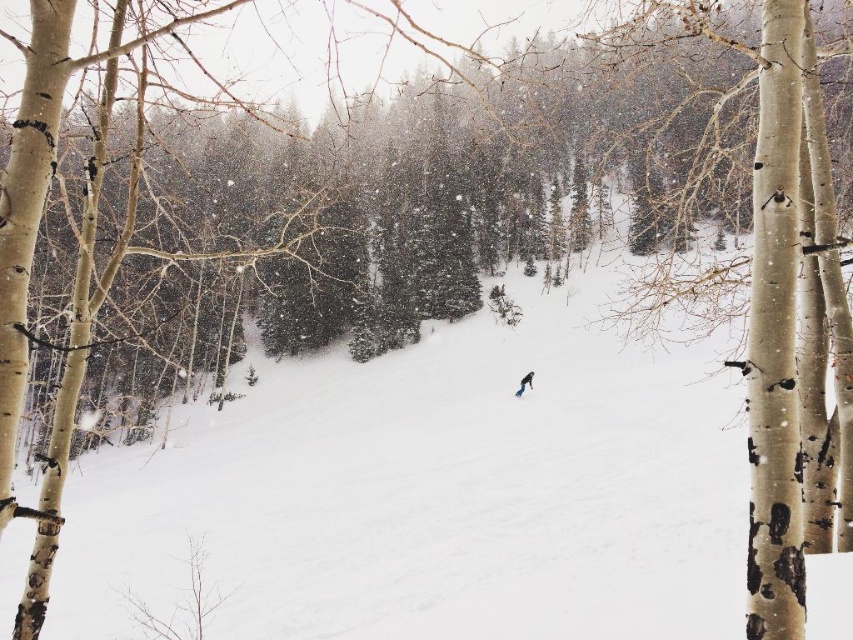
Is blue matte snowboard at center positioned in front of blue metallic ski at center?

No, blue matte snowboard at center is further to the viewer.

Between point (531, 384) and point (517, 394), which one is positioned in front?

Point (517, 394) is in front.

This screenshot has width=853, height=640. In order to click on blue matte snowboard at center in this screenshot , I will do `click(524, 384)`.